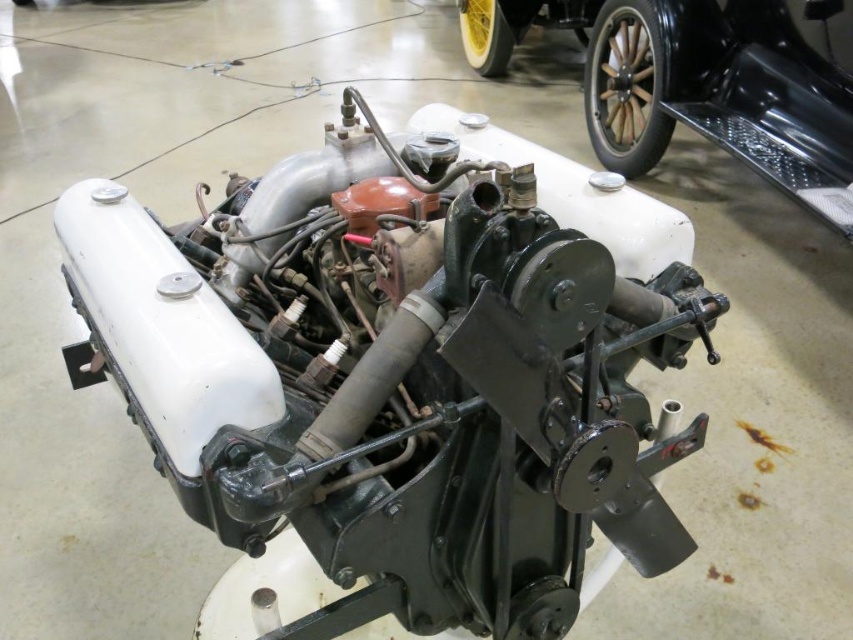
You are standing 3 feet away from the engine displayed in the museum. If you want to touch the point at coordinates point (387,300) on the engine, will you be able to reach it without moving closer?

The distance of point (387,300) from viewer is 34.55 inches. Since you are standing 3 feet away, which is 36 inches, you are 1.45 inches further away than the point. Therefore, you can reach it without moving closer.

You are a museum guide explaining the engine display to visitors. There are two engines labeled as matte black engine at center and metallic black engine at center. Which engine is closer to the visitors?

The matte black engine at center is closer to the visitors because it is in front of the metallic black engine at center.

You are an engineer inspecting two engines in a museum. You notice the matte black engine at center and the metallic black engine at center. Which engine has a shorter height?

The matte black engine at center is not as tall as the metallic black engine at center, so the matte black engine at center is shorter in height.